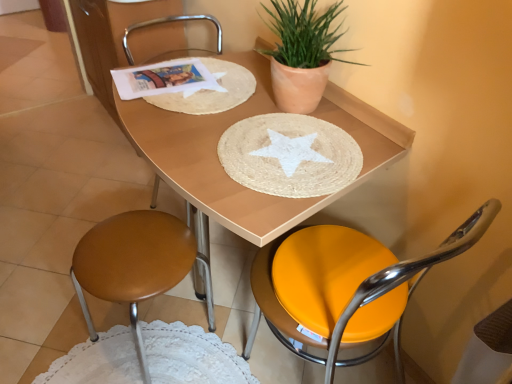
Question: Should I look upward or downward to see metallic silver chair at center, marked as the 2th chair in a left-to-right arrangement?

Choices:
 (A) down
 (B) up

Answer: (B)

Question: From the image's perspective, would you say white paper at upper left is shown under wooden placemat at center?

Choices:
 (A) no
 (B) yes

Answer: (A)

Question: From a real-world perspective, is white paper at upper left physically above wooden placemat at center?

Choices:
 (A) no
 (B) yes

Answer: (B)

Question: Is white paper at upper left smaller than wooden placemat at center?

Choices:
 (A) yes
 (B) no

Answer: (A)

Question: Does white paper at upper left have a lesser width compared to wooden placemat at center?

Choices:
 (A) yes
 (B) no

Answer: (A)

Question: Is white paper at upper left in contact with wooden placemat at center?

Choices:
 (A) yes
 (B) no

Answer: (B)

Question: Is white paper at upper left to the right of wooden placemat at center from the viewer's perspective?

Choices:
 (A) yes
 (B) no

Answer: (B)

Question: Is orange leather chair at center, the first chair positioned from the right, at the left side of white woven placemat at upper left, the second paper plate when ordered from bottom to top?

Choices:
 (A) no
 (B) yes

Answer: (A)

Question: Is orange leather chair at center, placed as the third chair when sorted from left to right, taller than white woven placemat at upper left, the second paper plate when ordered from bottom to top?

Choices:
 (A) yes
 (B) no

Answer: (A)

Question: Considering the relative sizes of orange leather chair at center, the first chair positioned from the right, and white woven placemat at upper left, which is the 1th paper plate from top to bottom, in the image provided, is orange leather chair at center, the first chair positioned from the right, wider than white woven placemat at upper left, which is the 1th paper plate from top to bottom,?

Choices:
 (A) no
 (B) yes

Answer: (B)

Question: From the image's perspective, does orange leather chair at center, the first chair positioned from the right, appear lower than white woven placemat at upper left, which is the 1th paper plate from top to bottom?

Choices:
 (A) no
 (B) yes

Answer: (B)

Question: From a real-world perspective, is orange leather chair at center, the first chair positioned from the right, over white woven placemat at upper left, which is the 1th paper plate from top to bottom?

Choices:
 (A) yes
 (B) no

Answer: (B)

Question: Is orange leather chair at center, placed as the third chair when sorted from left to right, oriented away from white woven placemat at upper left, which is the 1th paper plate from top to bottom?

Choices:
 (A) no
 (B) yes

Answer: (A)

Question: From the image's perspective, is wooden placemat at center located above orange leather chair at center, placed as the third chair when sorted from left to right?

Choices:
 (A) yes
 (B) no

Answer: (A)